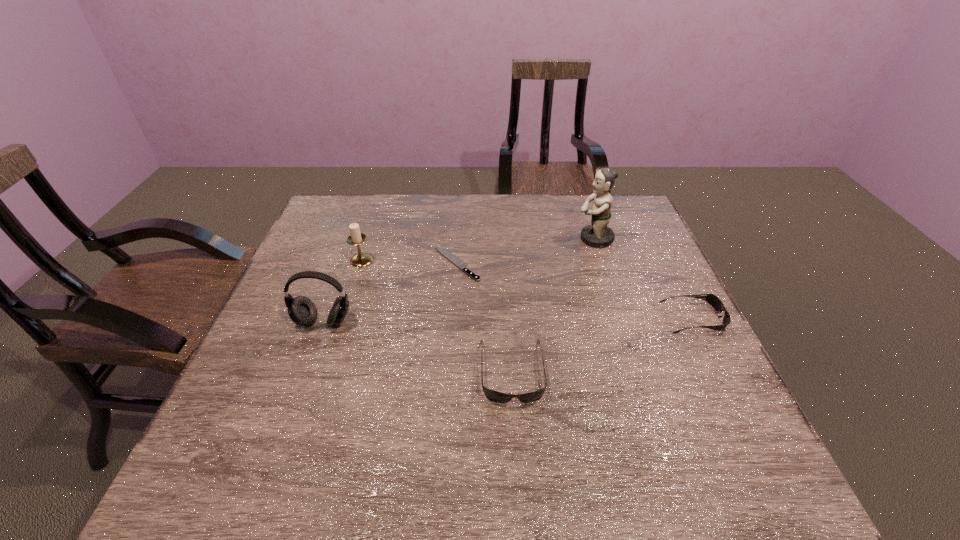
Find the location of a particular element. the nearest object is located at coordinates (495, 396).

At what (x,y) coordinates should I click in order to perform the action: click on the third object from right to left. Please return your answer as a coordinate pair (x, y). Looking at the image, I should click on (495, 396).

Locate an element on the screen. The width and height of the screenshot is (960, 540). the second shortest object is located at coordinates pyautogui.click(x=714, y=301).

Where is `the right sunglasses`? The height and width of the screenshot is (540, 960). the right sunglasses is located at coordinates (714, 301).

In order to click on the tallest object in this screenshot , I will do coord(597,234).

Locate an element on the screen. The height and width of the screenshot is (540, 960). the second object from right to left is located at coordinates (597, 234).

I want to click on the fourth shortest object, so click(361, 259).

Where is `the fourth object from right to left`? The image size is (960, 540). the fourth object from right to left is located at coordinates (450, 256).

Locate an element on the screen. The width and height of the screenshot is (960, 540). the shortest object is located at coordinates (450, 256).

Where is `headset`? This screenshot has height=540, width=960. headset is located at coordinates (302, 311).